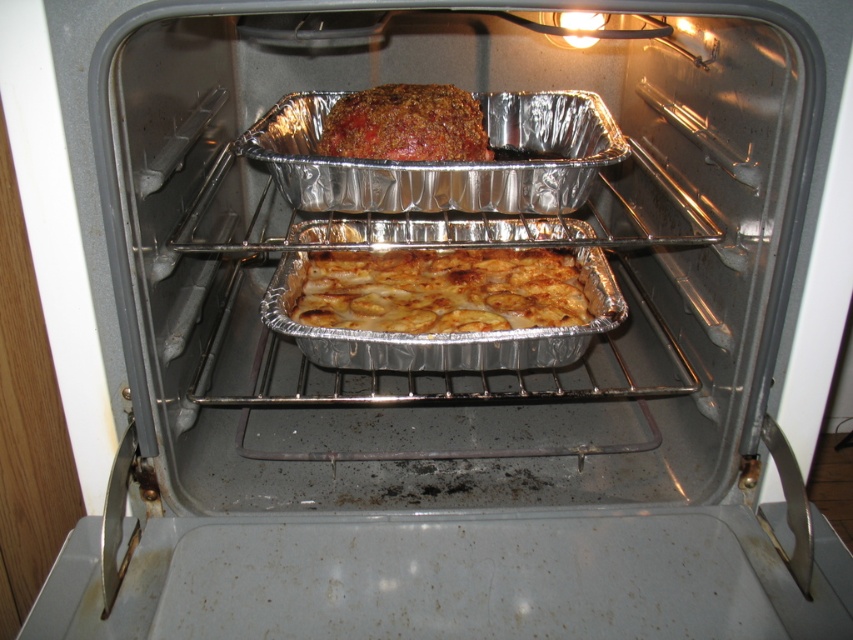
You are a chef who wants to check the doneness of the golden brown aluminum foil at center in an oven. The oven door is 36 inches wide. Can you safely open the oven door without burning your hand if you stand 36 inches away from the oven?

The golden brown aluminum foil at center is 34.02 inches away from the camera. Since you are standing 36 inches away from the oven, you are far enough to safely open the oven door without burning your hand.

You are a chef checking the oven. You see the golden brown aluminum foil at center and the baked brown meatloaf at center. Which one is more to the right?

The golden brown aluminum foil at center is positioned on the right side of baked brown meatloaf at center, so it is more to the right.

You are a chef checking the oven. You see the golden brown aluminum foil at center and the baked brown meatloaf at center. Which one is closer to you?

The golden brown aluminum foil at center is closer to you because it is positioned further to the viewer than the baked brown meatloaf at center.